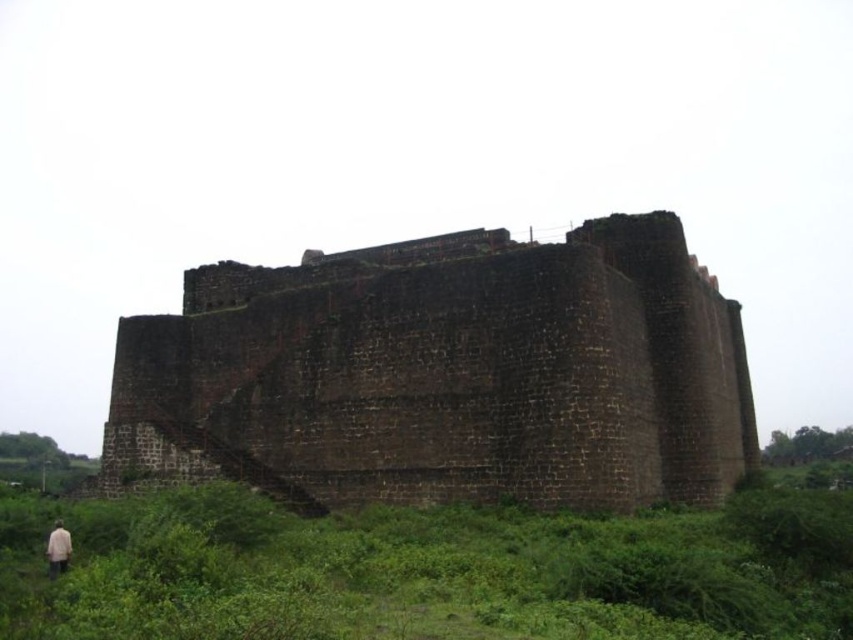
Who is shorter, brown stone castle at center or beige fabric person at lower left?

Standing shorter between the two is beige fabric person at lower left.

Which is behind, point (132, 428) or point (55, 560)?

The point (132, 428) is more distant.

Find the location of a particular element. This screenshot has height=640, width=853. brown stone castle at center is located at coordinates (447, 378).

From the picture: Is green leafy vegetation at lower left further to camera compared to beige fabric person at lower left?

No, it is not.

Which is above, green leafy vegetation at lower left or beige fabric person at lower left?

Positioned higher is green leafy vegetation at lower left.

Describe the element at coordinates (427, 570) in the screenshot. I see `green leafy vegetation at lower left` at that location.

Image resolution: width=853 pixels, height=640 pixels. Identify the location of green leafy vegetation at lower left. (427, 570).

In the scene shown: Measure the distance between brown stone castle at center and green leafy vegetation at lower left.

13.67 meters

Can you confirm if brown stone castle at center is positioned to the left of green leafy vegetation at lower left?

Incorrect, brown stone castle at center is not on the left side of green leafy vegetation at lower left.

Who is more forward, (x=264, y=320) or (x=793, y=538)?

Point (x=793, y=538) is in front.

The width and height of the screenshot is (853, 640). I want to click on brown stone castle at center, so click(x=447, y=378).